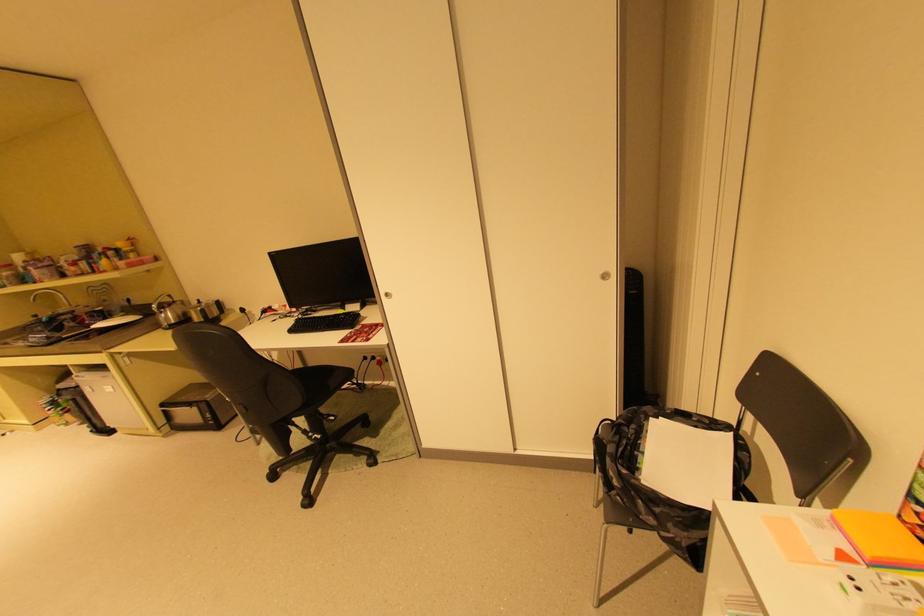
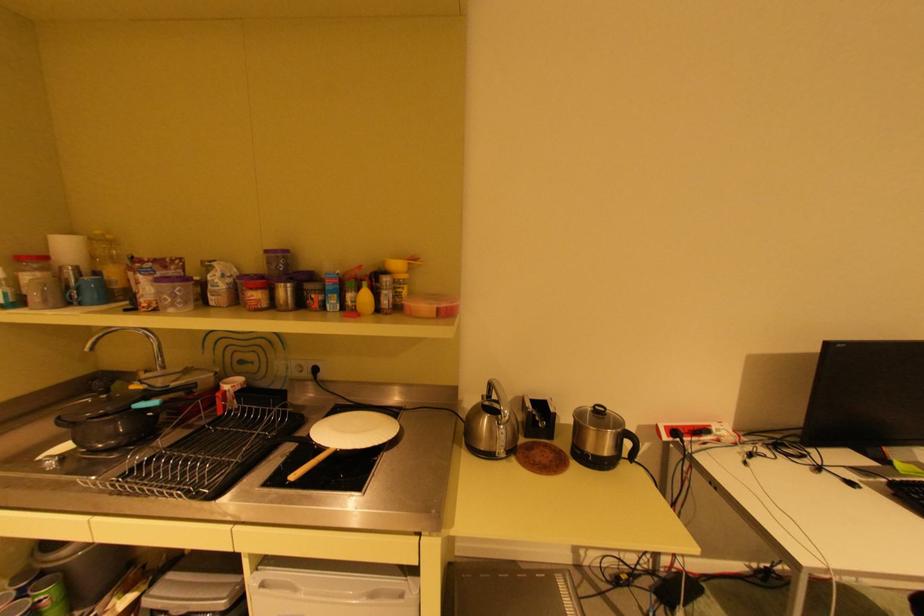
The images are taken continuously from a first-person perspective. In which direction are you moving?

The cameraman moved toward left, forward.